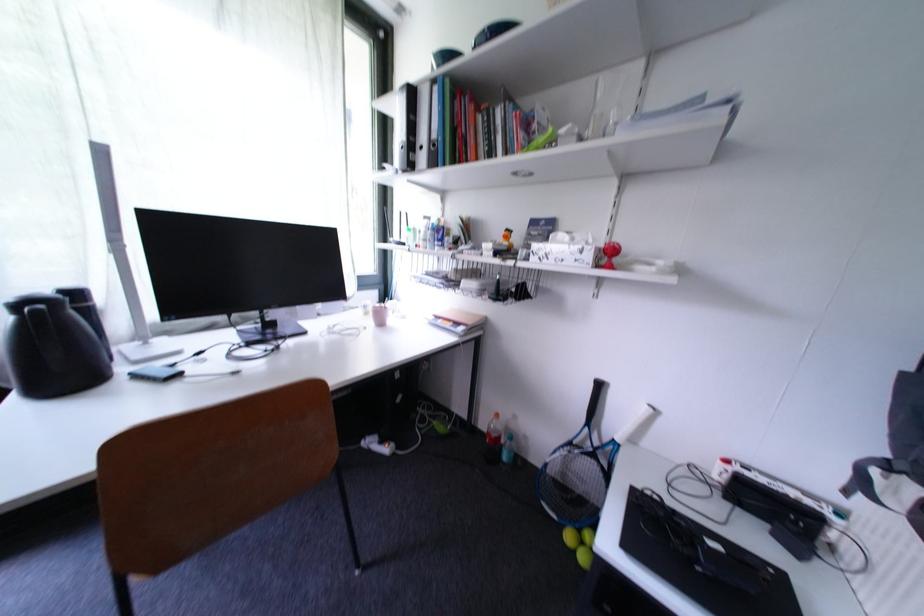
Locate an element on the screen. Image resolution: width=924 pixels, height=616 pixels. black thermos handle is located at coordinates (44, 336).